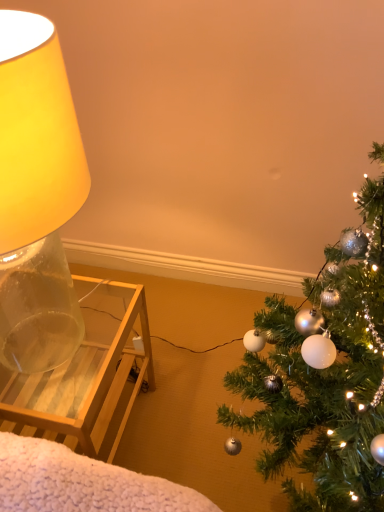
In order to click on unoccupied space behind shiny silver ornaments at right in this screenshot , I will do `click(204, 339)`.